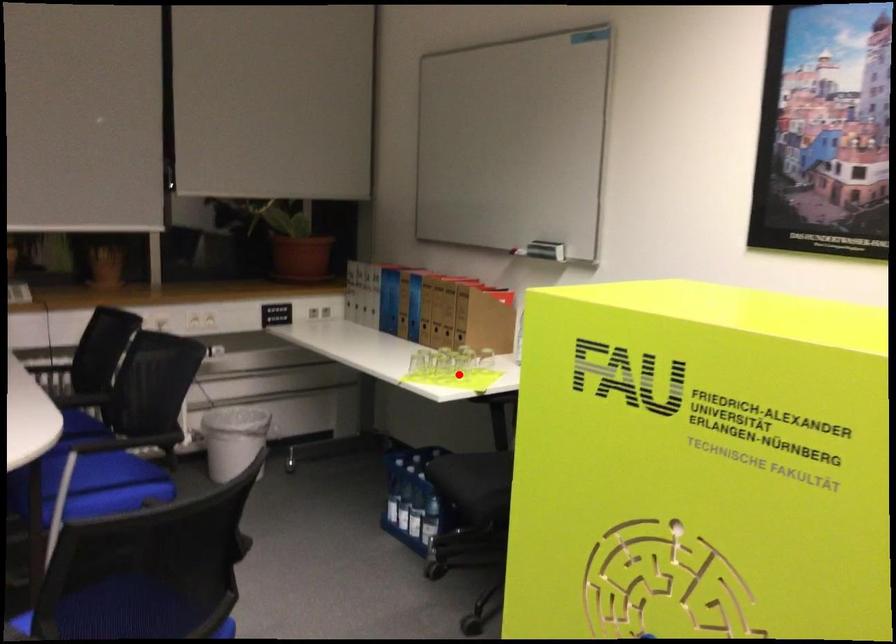
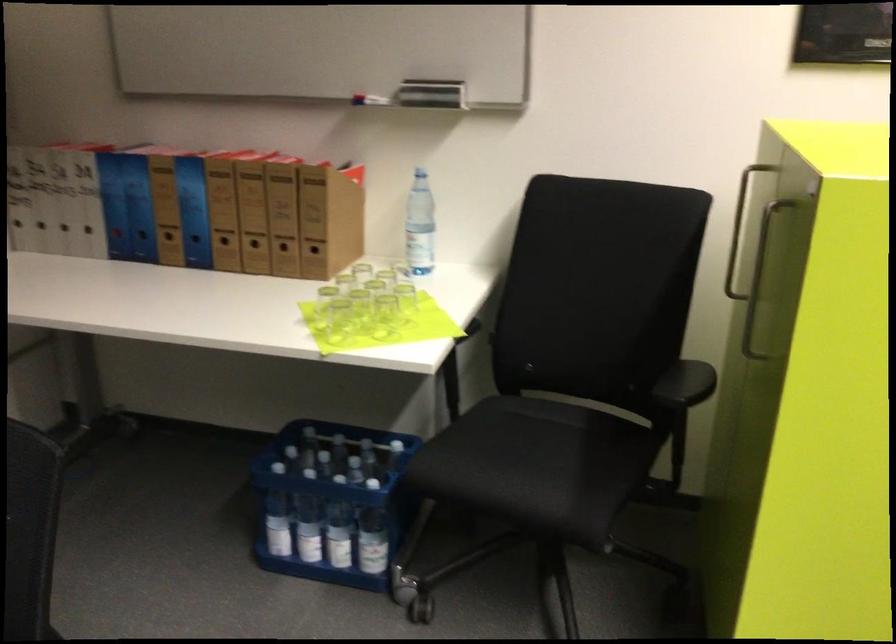
Question: I am providing you with two images of the same scene from different viewpoints. Given a red point in image1, look at the same physical point in image2. Is it:

Choices:
 (A) Closer to the viewpoint
 (B) Farther from the viewpoint

Answer: (A)